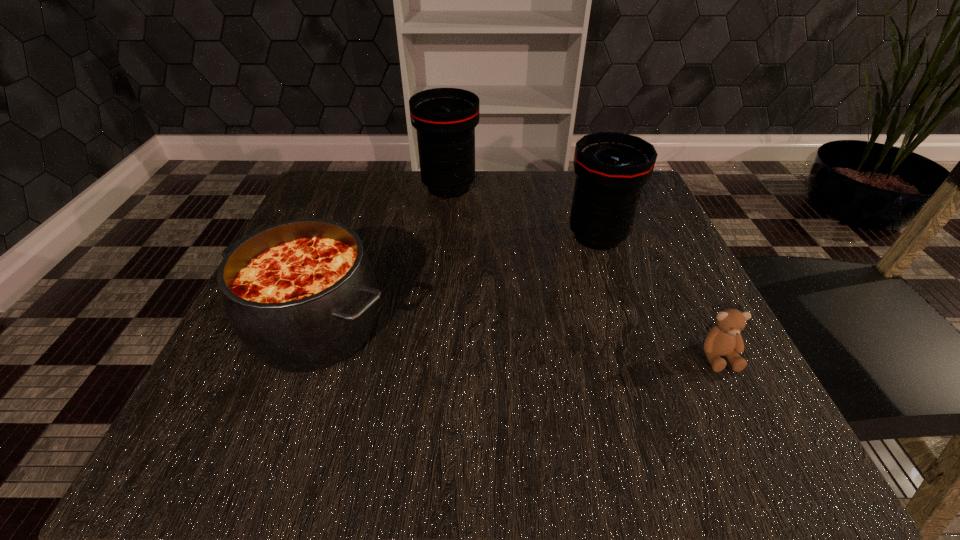
In the image, there is a desktop. What are the coordinates of `vacant space at the near right corner` in the screenshot? It's located at (698, 409).

Find the location of a particular element. The image size is (960, 540). blank region between the rightmost object and the third nearest object is located at coordinates (658, 296).

Locate an element on the screen. The width and height of the screenshot is (960, 540). vacant area that lies between the farthest object and the rightmost object is located at coordinates (584, 272).

Find the location of `vacant region between the farthest object and the right telephoto lens`. vacant region between the farthest object and the right telephoto lens is located at coordinates (523, 212).

This screenshot has width=960, height=540. I want to click on free space between the shortest object and the second farthest object, so click(x=658, y=296).

This screenshot has width=960, height=540. I want to click on free spot between the casserole and the nearer telephoto lens, so click(457, 281).

Where is `free space between the teddy bear and the second object from right to left`? The image size is (960, 540). free space between the teddy bear and the second object from right to left is located at coordinates 658,296.

Where is `vacant space that's between the third object from left to right and the casserole`? vacant space that's between the third object from left to right and the casserole is located at coordinates (457, 281).

At what (x,y) coordinates should I click in order to perform the action: click on vacant area that lies between the right telephoto lens and the teddy bear. Please return your answer as a coordinate pair (x, y). Looking at the image, I should click on (658, 296).

Where is `vacant area that lies between the shortest object and the nearer telephoto lens`? vacant area that lies between the shortest object and the nearer telephoto lens is located at coordinates (658, 296).